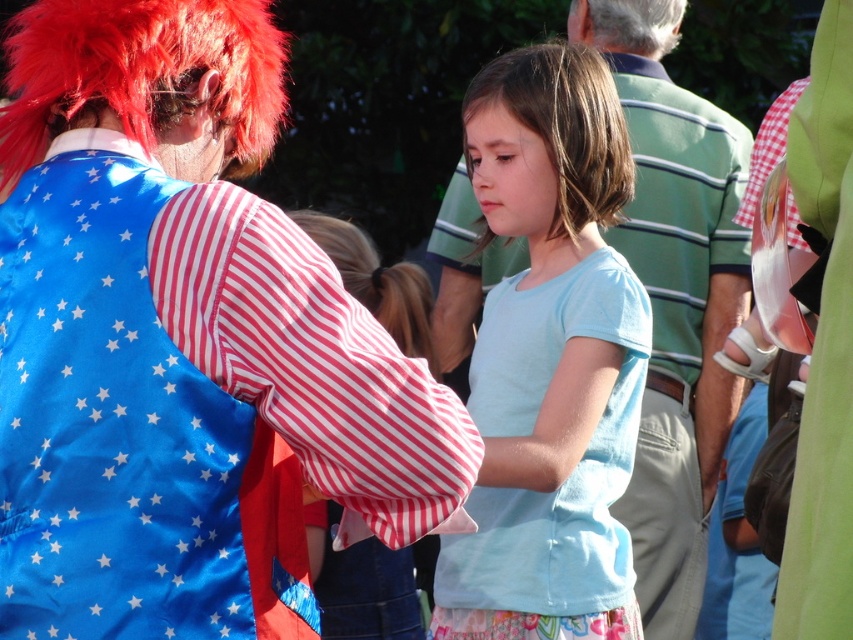
You are at a community event and see the green striped shirt at center and the light blue cotton dress at center. Which one is higher up?

The green striped shirt at center is located above the light blue cotton dress at center, so it is higher up.

Based on the coordinates provided, where is the blue satin vest at left located in the image?

The blue satin vest at left is located at the 2D coordinates point [190,404] in the image.

In the scene shown: You are organizing a costume party and need to arrange two items from the image. The light blue cotton dress at center and the fluffy red wig at upper center are both on a table. If you want to stack them so the taller item is at the bottom for stability, which item should you place on the bottom?

The light blue cotton dress at center is taller than the fluffy red wig at upper center, so you should place the light blue cotton dress at center on the bottom for stability.